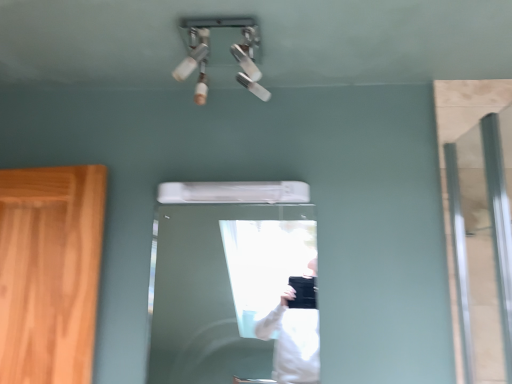
Question: Considering the positions of white glossy door at center and clear glass door at right in the image, is white glossy door at center bigger or smaller than clear glass door at right?

Choices:
 (A) small
 (B) big

Answer: (A)

Question: From the image's perspective, relative to clear glass door at right, is white glossy door at center above or below?

Choices:
 (A) above
 (B) below

Answer: (B)

Question: Considering the positions of white glossy door at center and clear glass door at right in the image, is white glossy door at center taller or shorter than clear glass door at right?

Choices:
 (A) short
 (B) tall

Answer: (A)

Question: Considering the positions of point coord(480,142) and point coord(181,364), is point coord(480,142) closer or farther from the camera than point coord(181,364)?

Choices:
 (A) farther
 (B) closer

Answer: (B)

Question: Considering the relative positions of clear glass door at right and white glossy door at center in the image provided, is clear glass door at right to the left or to the right of white glossy door at center?

Choices:
 (A) right
 (B) left

Answer: (A)

Question: Is clear glass door at right wider or thinner than white glossy door at center?

Choices:
 (A) thin
 (B) wide

Answer: (B)

Question: In terms of size, does clear glass door at right appear bigger or smaller than white glossy door at center?

Choices:
 (A) small
 (B) big

Answer: (B)